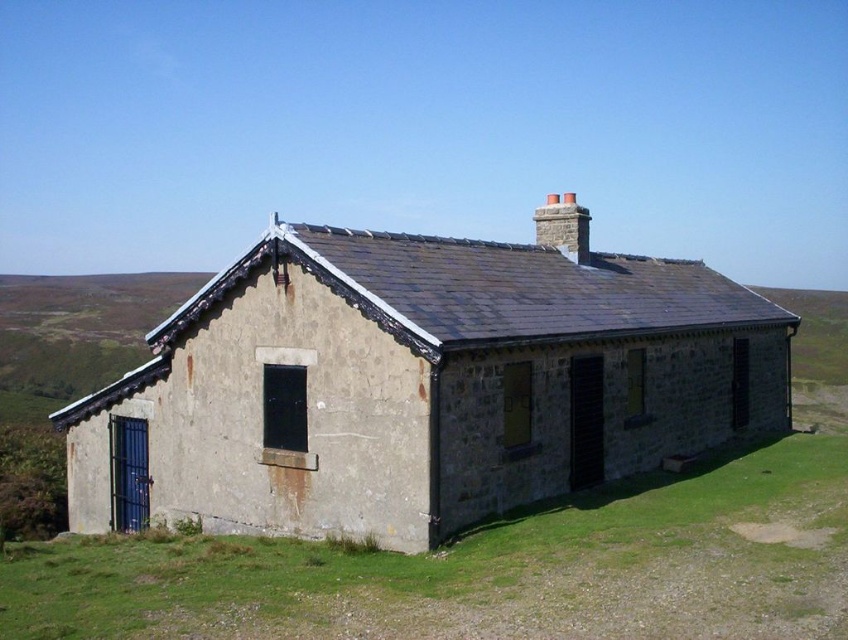
Who is more forward, [424,237] or [459,595]?

Point [459,595] is more forward.

Where is `rustic stone cottage at center`? This screenshot has width=848, height=640. rustic stone cottage at center is located at coordinates (421, 384).

Locate an element on the screen. rustic stone cottage at center is located at coordinates (421, 384).